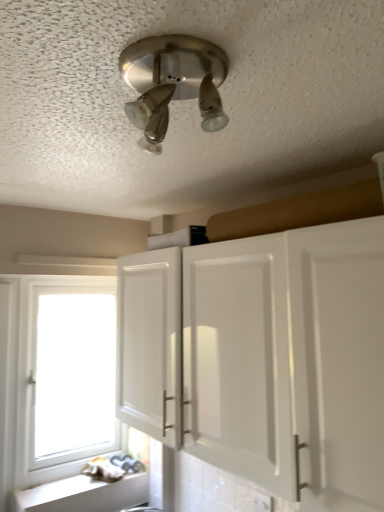
Measure the distance between white matte counter top at lower left and camera.

The distance of white matte counter top at lower left from camera is 1.87 meters.

Locate an element on the screen. white glossy cabinet at center is located at coordinates (289, 360).

What do you see at coordinates (173, 83) in the screenshot? I see `brushed metal light fixture at upper center` at bounding box center [173, 83].

Identify the location of white wood window at lower left. This screenshot has width=384, height=512. (64, 375).

Image resolution: width=384 pixels, height=512 pixels. Find the location of `white matte counter top at lower left`. white matte counter top at lower left is located at coordinates (83, 495).

Considering the sizes of objects white plastic electric outlet at lower center and white matte counter top at lower left in the image provided, who is taller, white plastic electric outlet at lower center or white matte counter top at lower left?

white plastic electric outlet at lower center.

Could you tell me if white plastic electric outlet at lower center is facing white matte counter top at lower left?

No, white plastic electric outlet at lower center is not turned towards white matte counter top at lower left.

Identify the location of electric outlet in front of the white matte counter top at lower left. This screenshot has width=384, height=512. (262, 502).

From a real-world perspective, is white plastic electric outlet at lower center positioned over white matte counter top at lower left based on gravity?

Yes, from a real-world perspective, white plastic electric outlet at lower center is above white matte counter top at lower left.

Between white glossy cabinet at center and white plastic electric outlet at lower center, which one has larger width?

white glossy cabinet at center.

Which object is positioned more to the left, white glossy cabinet at center or white plastic electric outlet at lower center?

white glossy cabinet at center.

Based on the photo, how many degrees apart are the facing directions of white glossy cabinet at center and white plastic electric outlet at lower center?

0.589 degrees.

Is white glossy cabinet at center taller or shorter than white plastic electric outlet at lower center?

In the image, white glossy cabinet at center appears to be taller than white plastic electric outlet at lower center.

Looking at the image, does white plastic electric outlet at lower center seem bigger or smaller compared to brushed metal light fixture at upper center?

In the image, white plastic electric outlet at lower center appears to be smaller than brushed metal light fixture at upper center.

Is the depth of white plastic electric outlet at lower center less than that of brushed metal light fixture at upper center?

No, it is not.

Between white plastic electric outlet at lower center and brushed metal light fixture at upper center, which one appears on the right side from the viewer's perspective?

white plastic electric outlet at lower center.

Would you say white plastic electric outlet at lower center is a long distance from brushed metal light fixture at upper center?

white plastic electric outlet at lower center is far away from brushed metal light fixture at upper center.

Considering the relative sizes of white plastic electric outlet at lower center and white glossy cabinet at center in the image provided, is white plastic electric outlet at lower center smaller than white glossy cabinet at center?

Indeed, white plastic electric outlet at lower center has a smaller size compared to white glossy cabinet at center.

Considering the relative sizes of white plastic electric outlet at lower center and white glossy cabinet at center in the image provided, is white plastic electric outlet at lower center thinner than white glossy cabinet at center?

Yes, white plastic electric outlet at lower center is thinner than white glossy cabinet at center.

Where is `electric outlet located underneath the white glossy cabinet at center (from a real-world perspective)`? The height and width of the screenshot is (512, 384). electric outlet located underneath the white glossy cabinet at center (from a real-world perspective) is located at coordinates (262, 502).

Consider the image. How different are the orientations of white plastic electric outlet at lower center and white glossy cabinet at center in degrees?

0.589 degrees separate the facing orientations of white plastic electric outlet at lower center and white glossy cabinet at center.

Based on the photo, what's the angular difference between white wood window at lower left and white glossy cabinet at center's facing directions?

They differ by 90.2 degrees in their facing directions.

Is white wood window at lower left wider than white glossy cabinet at center?

No, white wood window at lower left is not wider than white glossy cabinet at center.

Is white wood window at lower left shorter than white glossy cabinet at center?

Incorrect, the height of white wood window at lower left does not fall short of that of white glossy cabinet at center.

In the scene shown: Which object is positioned more to the left, white wood window at lower left or white glossy cabinet at center?

white wood window at lower left is more to the left.

Does white glossy cabinet at center appear on the left side of white matte counter top at lower left?

In fact, white glossy cabinet at center is to the right of white matte counter top at lower left.

In the scene shown: Is white glossy cabinet at center oriented towards white matte counter top at lower left?

No.

From a real-world perspective, who is located higher, white glossy cabinet at center or white matte counter top at lower left?

white glossy cabinet at center is physically above.

Would you say white glossy cabinet at center is inside or outside white matte counter top at lower left?

white glossy cabinet at center is spatially situated outside white matte counter top at lower left.

From a real-world perspective, is white wood window at lower left over white plastic electric outlet at lower center?

Yes.

Which point is more forward, (97, 339) or (257, 492)?

The point (257, 492) is in front.

Is white wood window at lower left beside white plastic electric outlet at lower center?

They are not placed beside each other.

You are a GUI agent. You are given a task and a screenshot of the screen. Output one action in this format:
    pyautogui.click(x=<x>, y=<y>)
    Task: Click on the window that appears behind the white plastic electric outlet at lower center
    The image size is (384, 512).
    Given the screenshot: What is the action you would take?
    pyautogui.click(x=64, y=375)

You are a GUI agent. You are given a task and a screenshot of the screen. Output one action in this format:
    pyautogui.click(x=<x>, y=<y>)
    Task: Click on the electric outlet on the right of white matte counter top at lower left
    
    Given the screenshot: What is the action you would take?
    pyautogui.click(x=262, y=502)

This screenshot has width=384, height=512. Identify the location of cabinetry located on the left of white plastic electric outlet at lower center. (289, 360).

Considering their positions, is brushed metal light fixture at upper center positioned further to white matte counter top at lower left than white glossy cabinet at center?

brushed metal light fixture at upper center is positioned further to the anchor white matte counter top at lower left.

Considering their positions, is white glossy cabinet at center positioned closer to white plastic electric outlet at lower center than brushed metal light fixture at upper center?

Based on the image, white glossy cabinet at center appears to be nearer to white plastic electric outlet at lower center.

From the image, which object appears to be farther from white plastic electric outlet at lower center, white glossy cabinet at center or white matte counter top at lower left?

The object further to white plastic electric outlet at lower center is white matte counter top at lower left.

Considering their positions, is white matte counter top at lower left positioned closer to white plastic electric outlet at lower center than white glossy cabinet at center?

white glossy cabinet at center is positioned closer to the anchor white plastic electric outlet at lower center.

Based on their spatial positions, is white plastic electric outlet at lower center or white wood window at lower left closer to white matte counter top at lower left?

Based on the image, white plastic electric outlet at lower center appears to be nearer to white matte counter top at lower left.

Based on their spatial positions, is white glossy cabinet at center or white matte counter top at lower left closer to brushed metal light fixture at upper center?

The object closer to brushed metal light fixture at upper center is white glossy cabinet at center.

Estimate the real-world distances between objects in this image. Which object is closer to brushed metal light fixture at upper center, white plastic electric outlet at lower center or white matte counter top at lower left?

The object closer to brushed metal light fixture at upper center is white plastic electric outlet at lower center.

From the image, which object appears to be farther from white wood window at lower left, white matte counter top at lower left or white plastic electric outlet at lower center?

white plastic electric outlet at lower center is positioned further to the anchor white wood window at lower left.

This screenshot has width=384, height=512. Find the location of `counter top between brushed metal light fixture at upper center and white wood window at lower left from front to back`. counter top between brushed metal light fixture at upper center and white wood window at lower left from front to back is located at coordinates (83, 495).

Locate an element on the screen. counter top between white wood window at lower left and white plastic electric outlet at lower center is located at coordinates (83, 495).

At what (x,y) coordinates should I click in order to perform the action: click on electric outlet between white glossy cabinet at center and white wood window at lower left along the z-axis. Please return your answer as a coordinate pair (x, y). The image size is (384, 512). Looking at the image, I should click on (262, 502).

I want to click on cabinetry between brushed metal light fixture at upper center and white matte counter top at lower left vertically, so click(x=289, y=360).